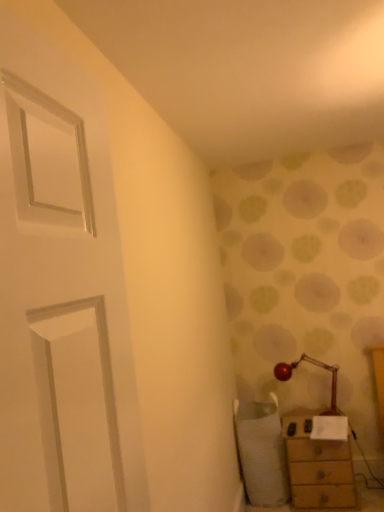
Question: Considering the relative sizes of wooden chest of drawers at lower right and metallic red table lamp at lower right in the image provided, is wooden chest of drawers at lower right taller than metallic red table lamp at lower right?

Choices:
 (A) yes
 (B) no

Answer: (A)

Question: Can you confirm if wooden chest of drawers at lower right is smaller than metallic red table lamp at lower right?

Choices:
 (A) yes
 (B) no

Answer: (B)

Question: Would you say metallic red table lamp at lower right is part of wooden chest of drawers at lower right's contents?

Choices:
 (A) yes
 (B) no

Answer: (B)

Question: Does wooden chest of drawers at lower right turn towards metallic red table lamp at lower right?

Choices:
 (A) no
 (B) yes

Answer: (A)

Question: From the image's perspective, does wooden chest of drawers at lower right appear lower than metallic red table lamp at lower right?

Choices:
 (A) yes
 (B) no

Answer: (A)

Question: From a real-world perspective, is wooden chest of drawers at lower right physically above metallic red table lamp at lower right?

Choices:
 (A) yes
 (B) no

Answer: (B)

Question: From a real-world perspective, is white textured swivel chair at lower right on top of wooden chest of drawers at lower right?

Choices:
 (A) no
 (B) yes

Answer: (B)

Question: Considering the relative sizes of white textured swivel chair at lower right and wooden chest of drawers at lower right in the image provided, is white textured swivel chair at lower right smaller than wooden chest of drawers at lower right?

Choices:
 (A) yes
 (B) no

Answer: (B)

Question: Is white textured swivel chair at lower right shorter than wooden chest of drawers at lower right?

Choices:
 (A) no
 (B) yes

Answer: (A)

Question: Could you tell me if white textured swivel chair at lower right is facing wooden chest of drawers at lower right?

Choices:
 (A) no
 (B) yes

Answer: (A)

Question: Are white textured swivel chair at lower right and wooden chest of drawers at lower right located far from each other?

Choices:
 (A) no
 (B) yes

Answer: (A)

Question: Is white textured swivel chair at lower right oriented away from wooden chest of drawers at lower right?

Choices:
 (A) no
 (B) yes

Answer: (A)

Question: Is wooden chest of drawers at lower right taller than white textured swivel chair at lower right?

Choices:
 (A) yes
 (B) no

Answer: (B)